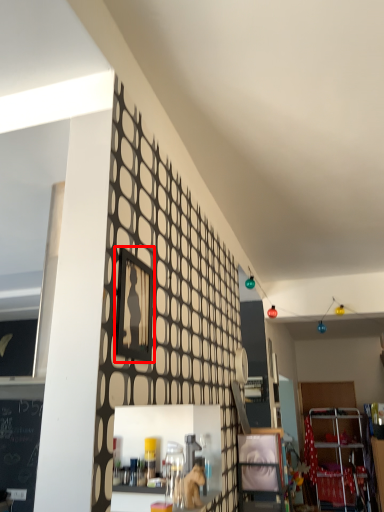
Question: From the image's perspective, what is the correct spatial relationship of picture frame (annotated by the red box) in relation to shelf?

Choices:
 (A) below
 (B) above

Answer: (B)